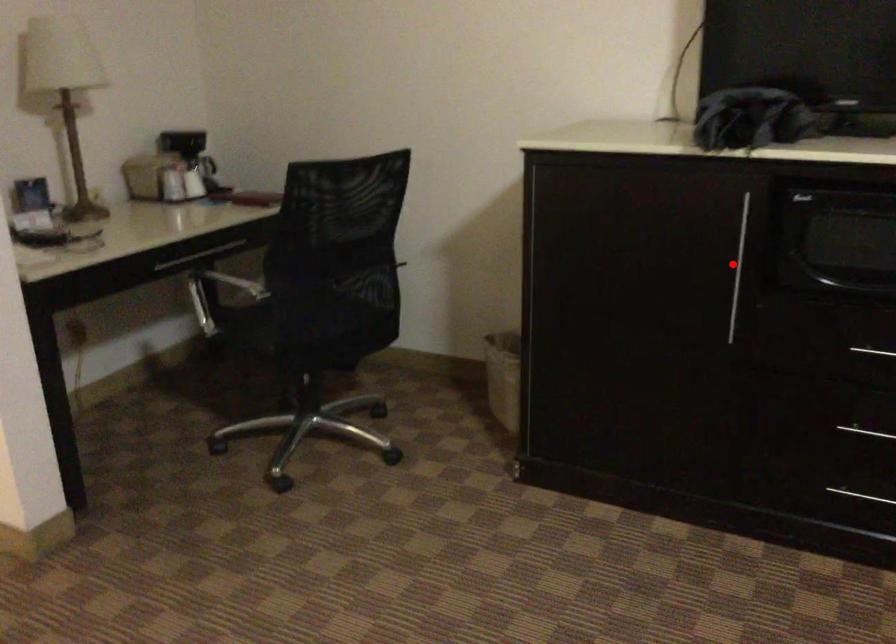
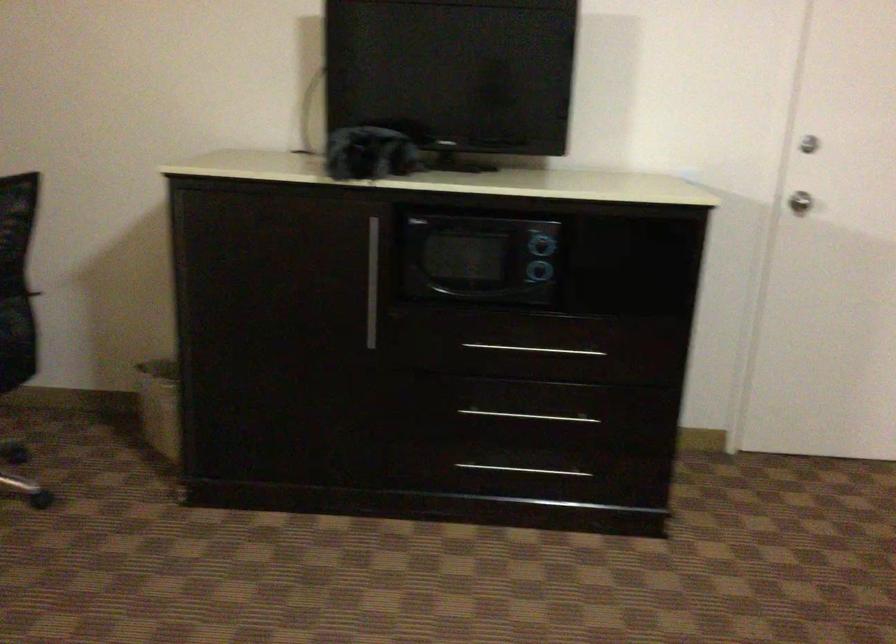
Locate, in the second image, the point that corresponds to the highlighted location in the first image.

(372, 283)